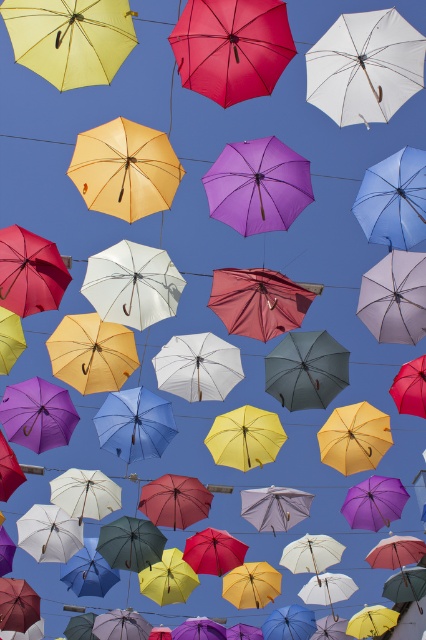
Can you confirm if matte yellow umbrella at center is wider than purple matte umbrella at center?

Correct, the width of matte yellow umbrella at center exceeds that of purple matte umbrella at center.

Can you confirm if matte yellow umbrella at center is positioned below purple matte umbrella at center?

No, matte yellow umbrella at center is not below purple matte umbrella at center.

Identify the location of matte yellow umbrella at center. The height and width of the screenshot is (640, 426). (124, 170).

Identify the location of matte yellow umbrella at center. This screenshot has height=640, width=426. point(124,170).

Between matte red umbrella at center and matte yellow umbrella at center, which one has less height?

With less height is matte yellow umbrella at center.

Which is in front, point (198, 65) or point (152, 157)?

Positioned in front is point (198, 65).

The width and height of the screenshot is (426, 640). What are the coordinates of `matte red umbrella at center` in the screenshot? It's located at (232, 48).

Looking at this image, does matte red umbrella at center appear over purple matte umbrella at center?

Correct, matte red umbrella at center is located above purple matte umbrella at center.

Is matte red umbrella at center shorter than purple matte umbrella at center?

No.

The width and height of the screenshot is (426, 640). I want to click on matte red umbrella at center, so click(x=232, y=48).